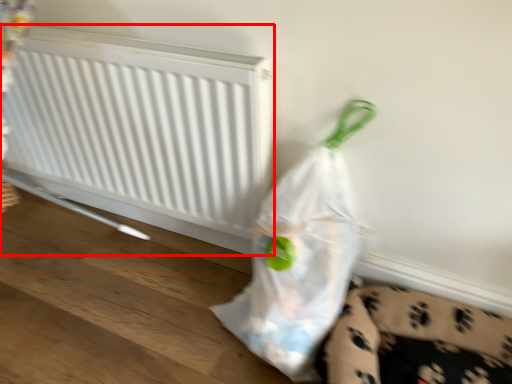
Question: Considering the relative positions of radiator (annotated by the red box) and plastic bag in the image provided, where is radiator (annotated by the red box) located with respect to the staircase?

Choices:
 (A) left
 (B) right

Answer: (A)